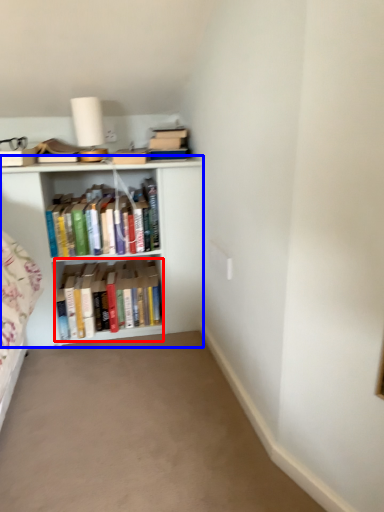
Question: Which object is further to the camera taking this photo, book (highlighted by a red box) or shelf (highlighted by a blue box)?

Choices:
 (A) book
 (B) shelf

Answer: (A)